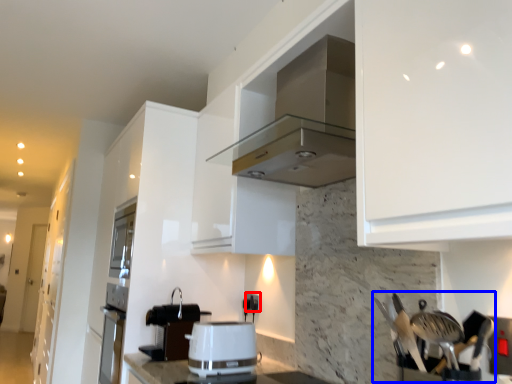
Question: Which object is further to the camera taking this photo, electric outlet (highlighted by a red box) or silverware (highlighted by a blue box)?

Choices:
 (A) electric outlet
 (B) silverware

Answer: (A)